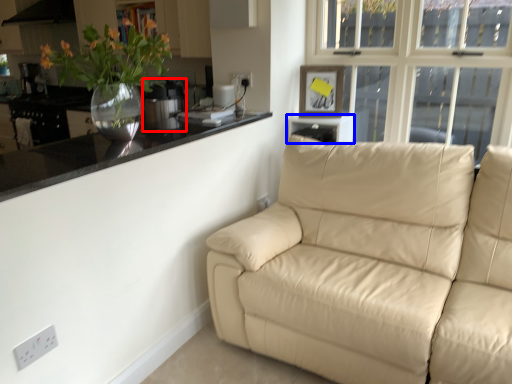
Question: Among these objects, which one is farthest to the camera, appliance (highlighted by a red box) or window sill (highlighted by a blue box)?

Choices:
 (A) appliance
 (B) window sill

Answer: (B)